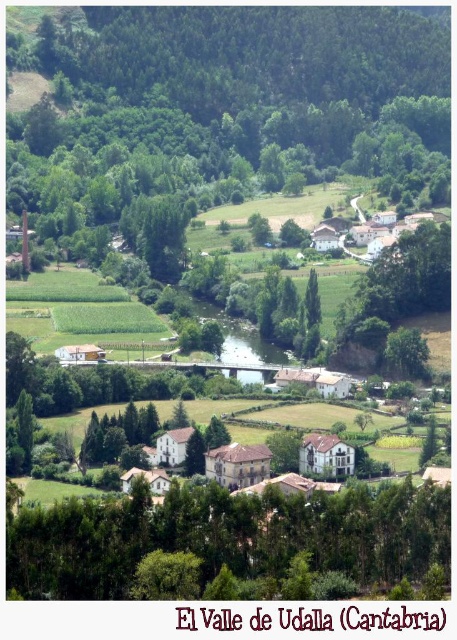
Question: Which object is farther from the camera taking this photo?

Choices:
 (A) green leafy tree at center
 (B) brown stone houses at center

Answer: (A)

Question: Is the position of green leafy trees at lower center less distant than that of green leafy tree at center?

Choices:
 (A) no
 (B) yes

Answer: (B)

Question: Among these points, which one is farthest from the camera?

Choices:
 (A) (26, 531)
 (B) (313, 292)
 (C) (292, 474)

Answer: (B)

Question: Which is farther from the brown stone houses at center?

Choices:
 (A) green leafy trees at lower center
 (B) green leafy tree at center

Answer: (B)

Question: Is brown stone houses at center bigger than green leafy tree at center?

Choices:
 (A) yes
 (B) no

Answer: (A)

Question: Does green leafy trees at lower center have a lesser width compared to brown stone houses at center?

Choices:
 (A) yes
 (B) no

Answer: (B)